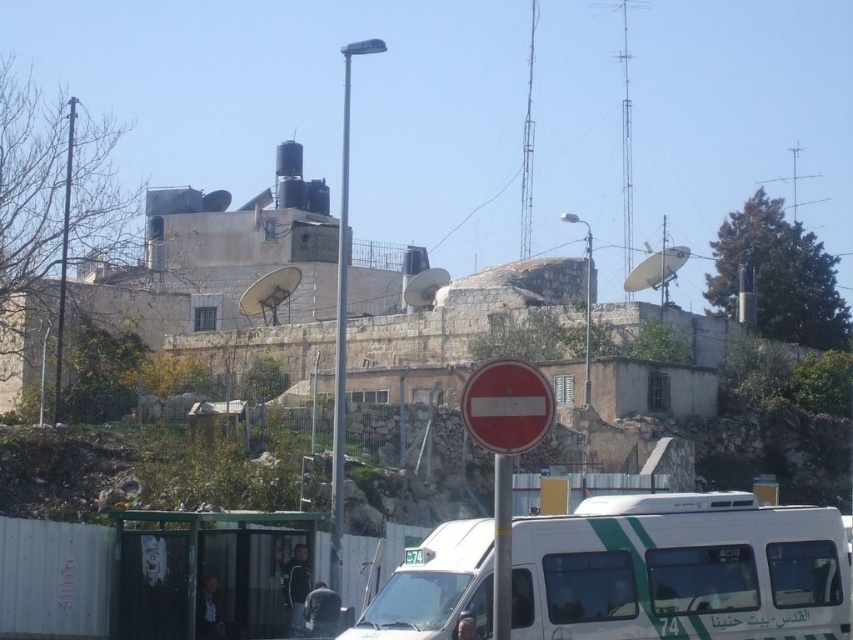
Question: Which point appears closest to the camera in this image?

Choices:
 (A) tap(422, 557)
 (B) tap(469, 416)

Answer: (B)

Question: Does white glossy van at center appear over red matte sign at center?

Choices:
 (A) yes
 (B) no

Answer: (B)

Question: Observing the image, what is the correct spatial positioning of white glossy van at center in reference to green plastic bus at center?

Choices:
 (A) right
 (B) left

Answer: (A)

Question: Is white glossy van at center positioned before green plastic bus at center?

Choices:
 (A) no
 (B) yes

Answer: (B)

Question: Considering the real-world distances, which object is closest to the white glossy van at center?

Choices:
 (A) red matte sign at center
 (B) green plastic bus at center

Answer: (A)

Question: Which of the following is the farthest from the observer?

Choices:
 (A) white glossy van at center
 (B) green plastic bus at center

Answer: (B)